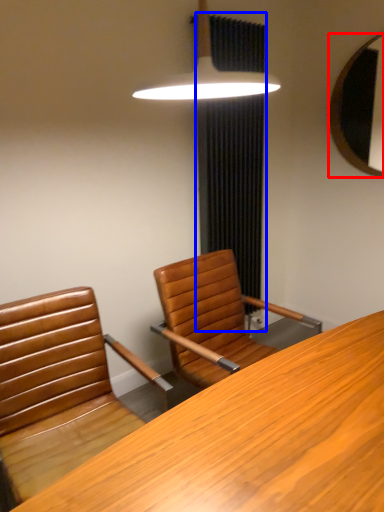
Question: Which object appears farthest to the camera in this image, mirror (highlighted by a red box) or curtain (highlighted by a blue box)?

Choices:
 (A) mirror
 (B) curtain

Answer: (A)